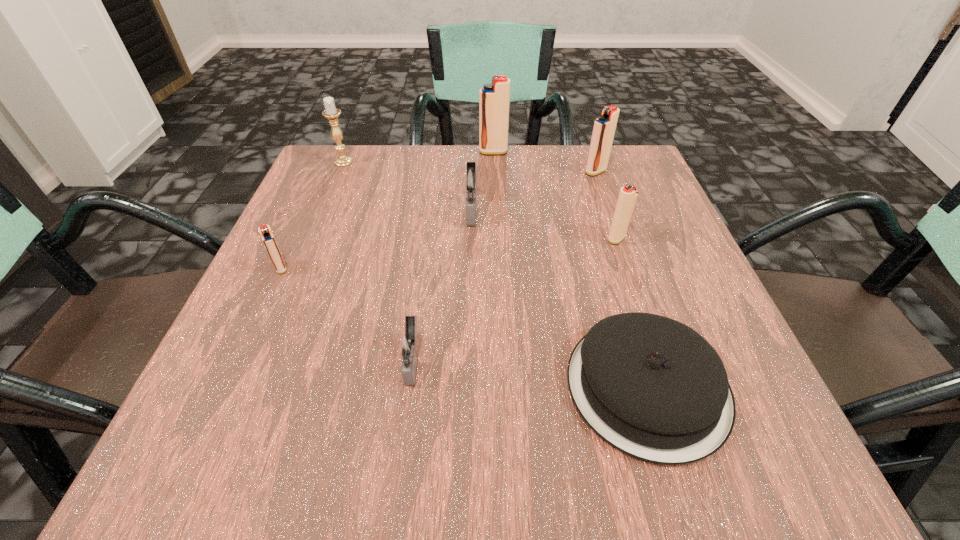
The height and width of the screenshot is (540, 960). What are the coordinates of `the leftmost red igniter` in the screenshot? It's located at 267,236.

The image size is (960, 540). Identify the location of the nearest igniter. (409, 345).

Locate an element on the screen. This screenshot has width=960, height=540. the fifth igniter from right to left is located at coordinates click(x=409, y=345).

This screenshot has height=540, width=960. Identify the location of pancake. (653, 388).

Locate an element on the screen. The width and height of the screenshot is (960, 540). vacant space situated 0.090m on the right of the farthest igniter is located at coordinates (544, 152).

Where is `vacant space located on the right of the candle holder`? The image size is (960, 540). vacant space located on the right of the candle holder is located at coordinates (442, 162).

This screenshot has height=540, width=960. I want to click on vacant space located on the front of the third nearest red igniter, so click(x=639, y=299).

Find the location of `free space located on the front of the bigger gray igniter`. free space located on the front of the bigger gray igniter is located at coordinates (469, 295).

At what (x,y) coordinates should I click in order to perform the action: click on vacant space situated 0.160m on the front of the second smallest red igniter. Please return your answer as a coordinate pair (x, y). Looking at the image, I should click on (641, 310).

Identify the location of free location located 0.200m on the back of the nearest red igniter. (313, 198).